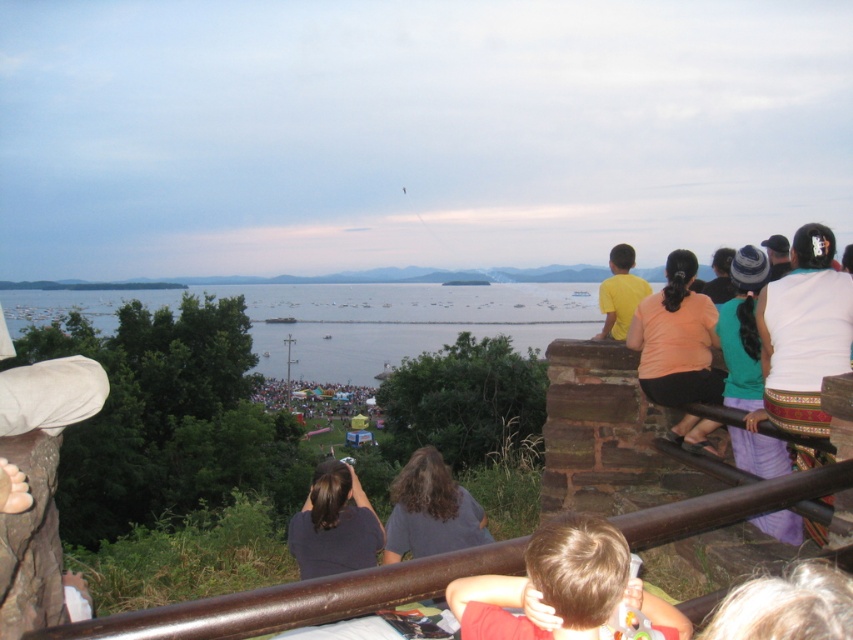
Is blonde hair at lower right to the left of dark blue shirt at lower center from the viewer's perspective?

In fact, blonde hair at lower right is to the right of dark blue shirt at lower center.

Is point (721, 616) positioned behind point (337, 460)?

No, (721, 616) is closer to viewer.

I want to click on blonde hair at lower right, so click(x=787, y=605).

Consider the image. Is white cotton shirt at upper right closer to the viewer compared to dark blue shirt at lower center?

Yes, it is in front of dark blue shirt at lower center.

Is white cotton shirt at upper right smaller than dark blue shirt at lower center?

Actually, white cotton shirt at upper right might be larger than dark blue shirt at lower center.

The image size is (853, 640). What do you see at coordinates (804, 332) in the screenshot?
I see `white cotton shirt at upper right` at bounding box center [804, 332].

Locate an element on the screen. The width and height of the screenshot is (853, 640). white cotton shirt at upper right is located at coordinates (804, 332).

Does light brown hair at lower center have a smaller size compared to gray fabric shirt at center?

Indeed, light brown hair at lower center has a smaller size compared to gray fabric shirt at center.

Is light brown hair at lower center to the left of gray fabric shirt at center from the viewer's perspective?

No, light brown hair at lower center is not to the left of gray fabric shirt at center.

Does point (590, 518) lie behind point (386, 538)?

No, (590, 518) is in front of (386, 538).

Where is `light brown hair at lower center`? The width and height of the screenshot is (853, 640). light brown hair at lower center is located at coordinates [x=563, y=588].